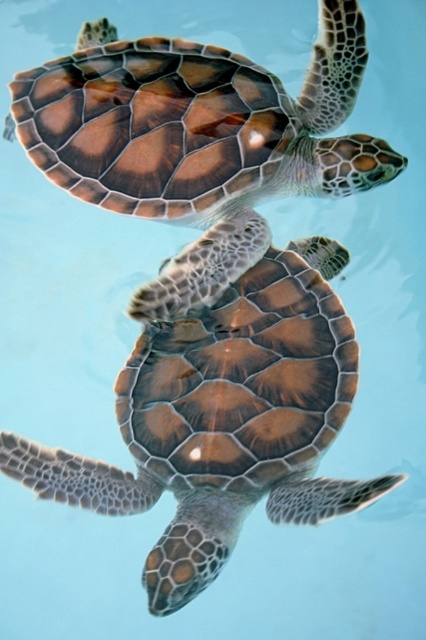
You are a marine biologist observing two sea turtles underwater. You notice the brown textured shell at center and the brown textured shell at upper center. Which turtle has a larger shell?

The brown textured shell at center has a larger size compared to the brown textured shell at upper center, so the turtle with the brown textured shell at center has the larger shell.

You are a marine biologist observing two sea turtles underwater. You notice the brown textured shell at center and the brown textured shell at upper center. Which turtle is closer to you based on their positions?

The brown textured shell at center is closer to you because it is positioned in front of the brown textured shell at upper center.

Looking at this image, you are a marine biologist observing the underwater scene. You notice a brown textured shell at center. Can you determine its exact coordinates in the image?

The brown textured shell at center is located at coordinates point (222, 419).